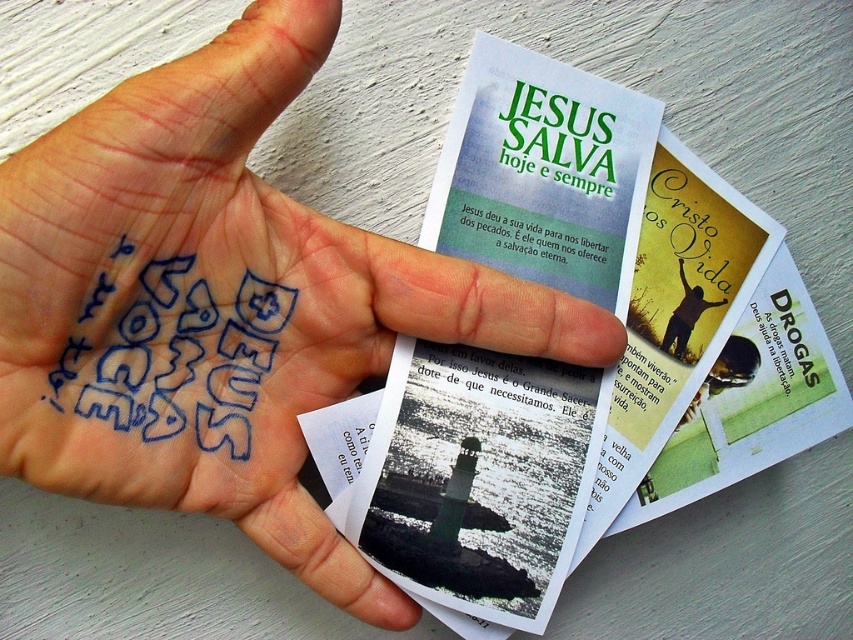
Question: In this image, where is white paper postcard at center located relative to silhouette figure at center?

Choices:
 (A) above
 (B) below

Answer: (B)

Question: Is white paper postcard at center above silhouette figure at center?

Choices:
 (A) yes
 (B) no

Answer: (B)

Question: Which object appears closest to the camera in this image?

Choices:
 (A) green paper text at center
 (B) blue ink palm at center
 (C) silhouette figure at center

Answer: (B)

Question: Considering the real-world distances, which object is farthest from the green paper text at center?

Choices:
 (A) black paper text at center
 (B) blue ink palm at center
 (C) white paper postcard at center
 (D) silhouette figure at center

Answer: (B)

Question: Does green paper text at center appear under black paper text at center?

Choices:
 (A) no
 (B) yes

Answer: (A)

Question: Which point appears farthest from the camera in this image?

Choices:
 (A) coord(183,394)
 (B) coord(379,500)

Answer: (B)